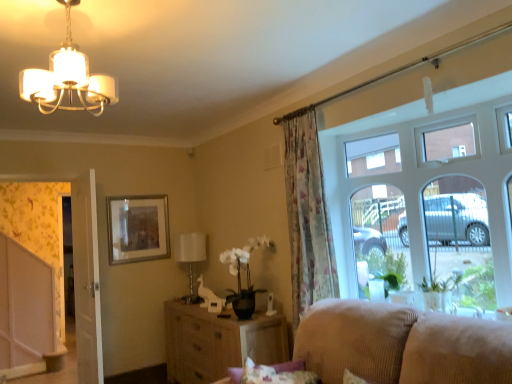
Question: Is woven wood cabinet at center at the back of floral fabric curtain at center?

Choices:
 (A) no
 (B) yes

Answer: (A)

Question: Would you say floral fabric curtain at center is outside woven wood cabinet at center?

Choices:
 (A) no
 (B) yes

Answer: (B)

Question: Considering the relative sizes of floral fabric curtain at center and woven wood cabinet at center in the image provided, is floral fabric curtain at center taller than woven wood cabinet at center?

Choices:
 (A) yes
 (B) no

Answer: (A)

Question: From a real-world perspective, is floral fabric curtain at center on top of woven wood cabinet at center?

Choices:
 (A) no
 (B) yes

Answer: (B)

Question: Could you tell me if floral fabric curtain at center is facing woven wood cabinet at center?

Choices:
 (A) yes
 (B) no

Answer: (B)

Question: Which is correct: floral fabric curtain at center is inside woven wood cabinet at center, or outside of it?

Choices:
 (A) outside
 (B) inside

Answer: (A)

Question: In the image, is floral fabric curtain at center on the left side or the right side of woven wood cabinet at center?

Choices:
 (A) right
 (B) left

Answer: (A)

Question: From a real-world perspective, relative to woven wood cabinet at center, is floral fabric curtain at center vertically above or below?

Choices:
 (A) below
 (B) above

Answer: (B)

Question: From the image's perspective, is floral fabric curtain at center above or below woven wood cabinet at center?

Choices:
 (A) above
 (B) below

Answer: (A)

Question: In the image, is matte white chandelier at upper left, which is the 2th lamp from bottom to top, on the left side or the right side of clear glass window at right?

Choices:
 (A) left
 (B) right

Answer: (A)

Question: Is point (32, 100) closer or farther from the camera than point (345, 152)?

Choices:
 (A) closer
 (B) farther

Answer: (A)

Question: Choose the correct answer: Is matte white chandelier at upper left, the first lamp viewed from the top, inside clear glass window at right or outside it?

Choices:
 (A) outside
 (B) inside

Answer: (A)

Question: Considering the positions of matte white chandelier at upper left, the 1th lamp when ordered from front to back, and clear glass window at right in the image, is matte white chandelier at upper left, the 1th lamp when ordered from front to back, taller or shorter than clear glass window at right?

Choices:
 (A) tall
 (B) short

Answer: (B)

Question: Is floral fabric curtain at center bigger or smaller than beige corduroy couch at lower right?

Choices:
 (A) big
 (B) small

Answer: (B)

Question: Considering the positions of point (292, 312) and point (449, 329), is point (292, 312) closer or farther from the camera than point (449, 329)?

Choices:
 (A) farther
 (B) closer

Answer: (A)